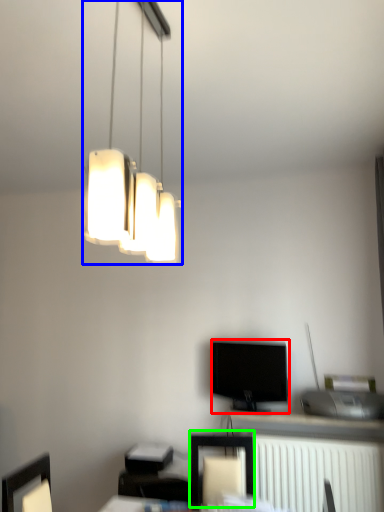
Question: Estimate the real-world distances between objects in this image. Which object is farther from television (highlighted by a red box), lamp (highlighted by a blue box) or furniture (highlighted by a green box)?

Choices:
 (A) lamp
 (B) furniture

Answer: (A)